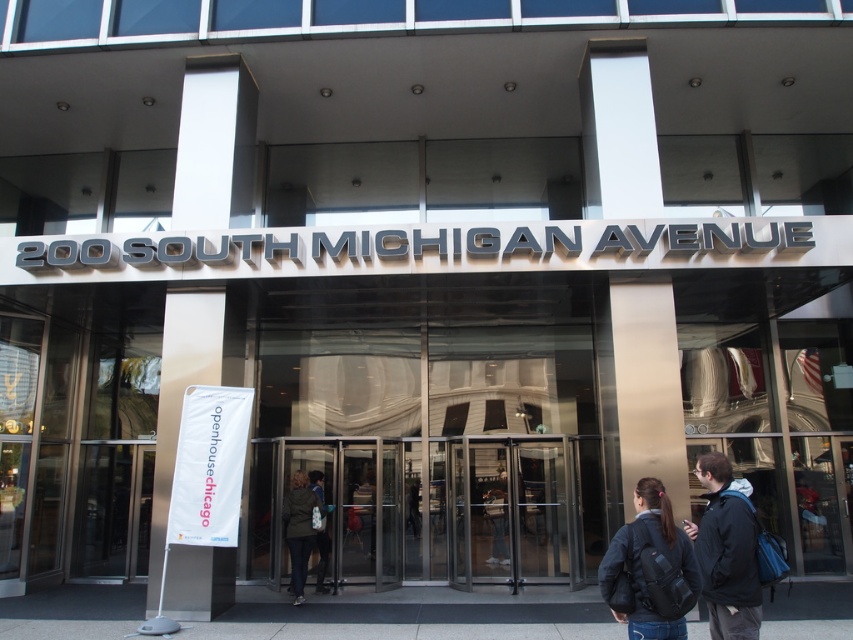
Does black backpack at center appear over green fabric coat at center?

Yes, black backpack at center is above green fabric coat at center.

Consider the image. Does black backpack at center have a lesser width compared to green fabric coat at center?

No.

This screenshot has height=640, width=853. What are the coordinates of `black backpack at center` in the screenshot? It's located at (712, 547).

Can you confirm if black matte jacket at lower right is positioned below green fabric coat at center?

Incorrect, black matte jacket at lower right is not positioned below green fabric coat at center.

Is point (704, 584) less distant than point (297, 513)?

Yes.

Which is in front, point (711, 625) or point (292, 556)?

Positioned in front is point (711, 625).

Locate an element on the screen. black matte jacket at lower right is located at coordinates [726, 552].

Between black backpack at center and black matte jacket at lower right, which one has more height?

black matte jacket at lower right is taller.

Find the location of a particular element. black backpack at center is located at coordinates (712, 547).